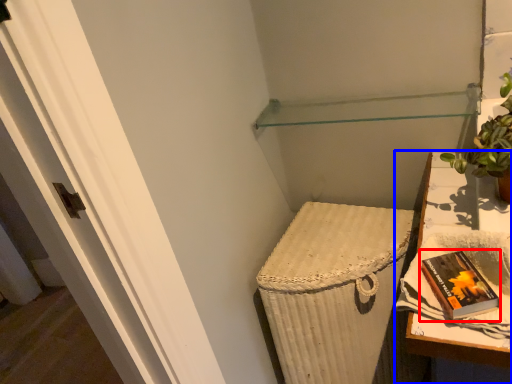
Question: Which of the following is the closest to the observer, paperback book (highlighted by a red box) or table (highlighted by a blue box)?

Choices:
 (A) paperback book
 (B) table

Answer: (B)